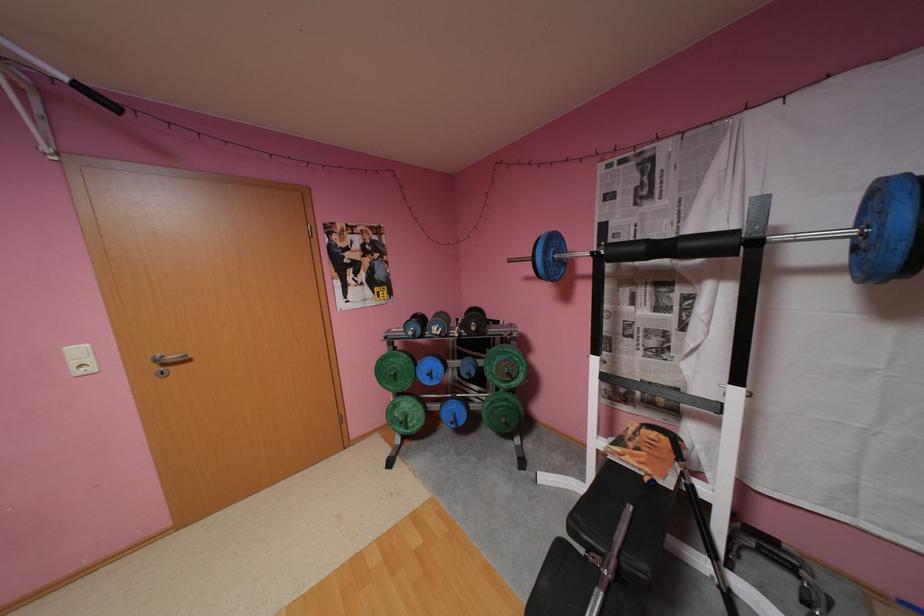
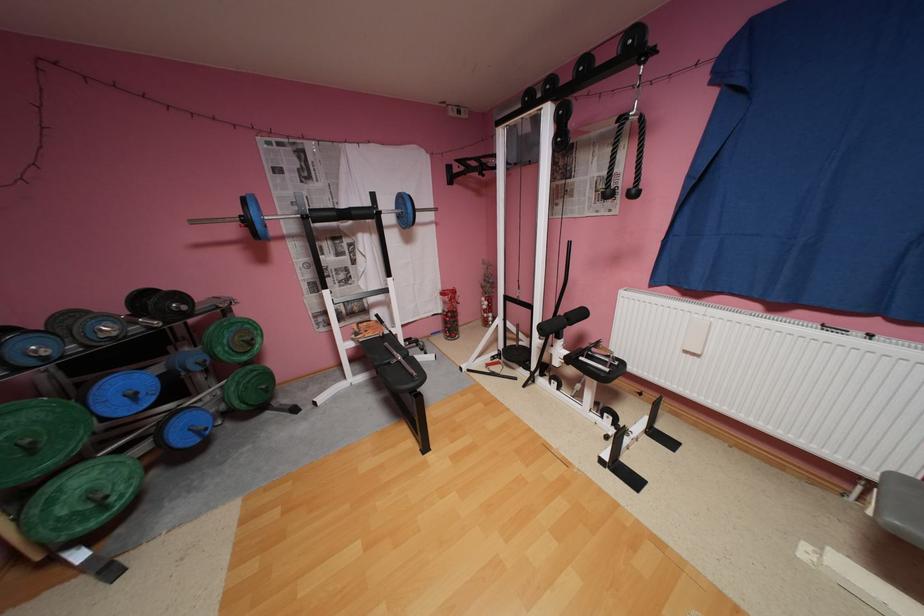
The images are taken continuously from a first-person perspective. In which direction is your viewpoint rotating?

The camera's rotation is toward right-down.